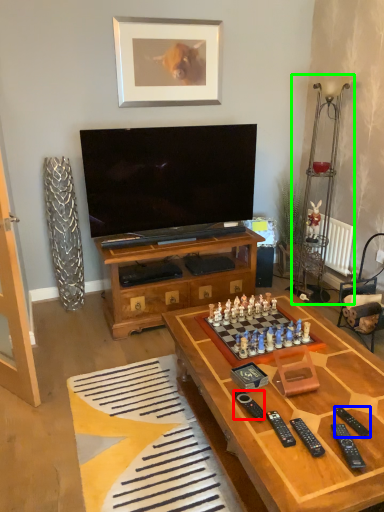
Question: Which object is the farthest from remote (highlighted by a red box)? Choose among these: remote (highlighted by a blue box) or lamp (highlighted by a green box).

Choices:
 (A) remote
 (B) lamp

Answer: (B)